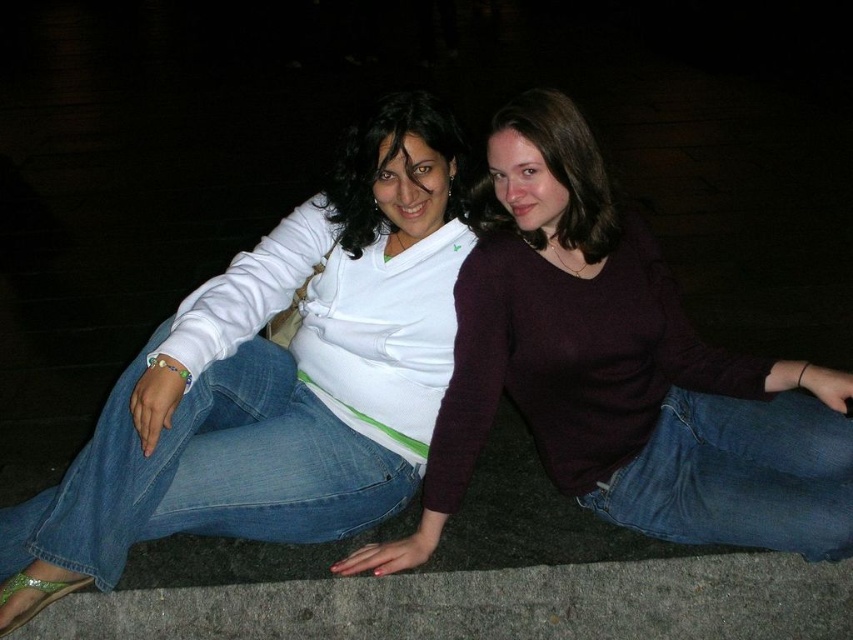
Is denim jeans at center bigger than matte white shirt at center?

Yes, denim jeans at center is bigger than matte white shirt at center.

Identify the location of denim jeans at center. The width and height of the screenshot is (853, 640). (274, 380).

Does point (276, 346) lie behind point (329, 179)?

No.

This screenshot has width=853, height=640. Find the location of `denim jeans at center`. denim jeans at center is located at coordinates (274, 380).

The width and height of the screenshot is (853, 640). Describe the element at coordinates (488, 604) in the screenshot. I see `gray concrete at lower center` at that location.

Does gray concrete at lower center have a lesser height compared to matte white shirt at center?

Correct, gray concrete at lower center is not as tall as matte white shirt at center.

Is point (735, 609) less distant than point (367, 128)?

No, (735, 609) is further to viewer.

At what (x,y) coordinates should I click in order to perform the action: click on gray concrete at lower center. Please return your answer as a coordinate pair (x, y). The height and width of the screenshot is (640, 853). Looking at the image, I should click on (488, 604).

Which is in front, point (200, 529) or point (685, 500)?

Point (685, 500) is more forward.

The width and height of the screenshot is (853, 640). I want to click on denim jeans at lower left, so pyautogui.click(x=209, y=472).

Image resolution: width=853 pixels, height=640 pixels. I want to click on denim jeans at lower left, so click(209, 472).